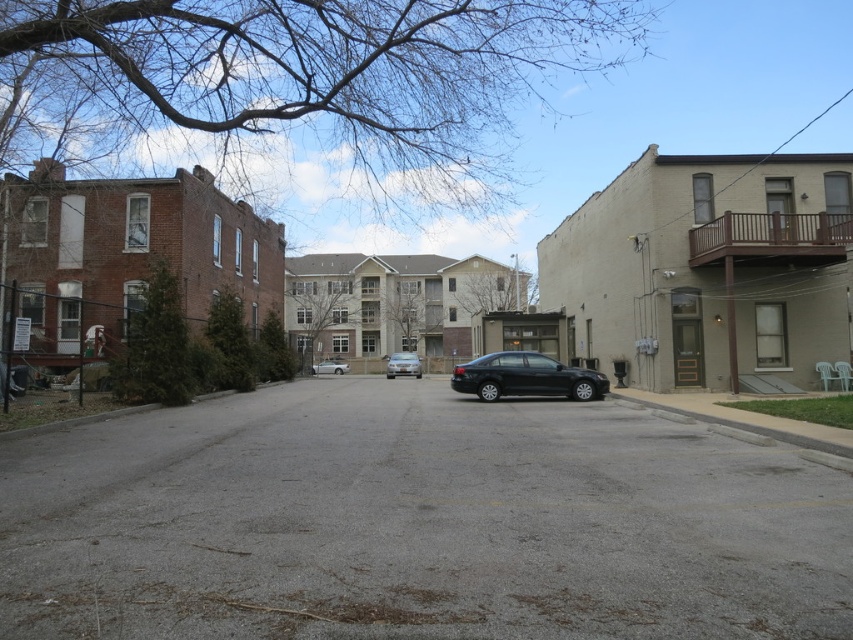
Question: Is gray asphalt road at center to the right of satin silver sedan at center from the viewer's perspective?

Choices:
 (A) yes
 (B) no

Answer: (A)

Question: Among these points, which one is farthest from the camera?

Choices:
 (A) (410, 362)
 (B) (467, 449)
 (C) (561, 380)
 (D) (321, 369)

Answer: (D)

Question: Does satin silver sedan at center come behind silver metallic car at center?

Choices:
 (A) yes
 (B) no

Answer: (B)

Question: Which point appears closest to the camera in this image?

Choices:
 (A) (315, 369)
 (B) (387, 362)

Answer: (B)

Question: Based on their relative distances, which object is nearer to the silver metallic car at center?

Choices:
 (A) gray asphalt road at center
 (B) black matte sedan at center

Answer: (B)

Question: Can you confirm if black matte sedan at center is positioned to the left of silver metallic car at center?

Choices:
 (A) no
 (B) yes

Answer: (A)